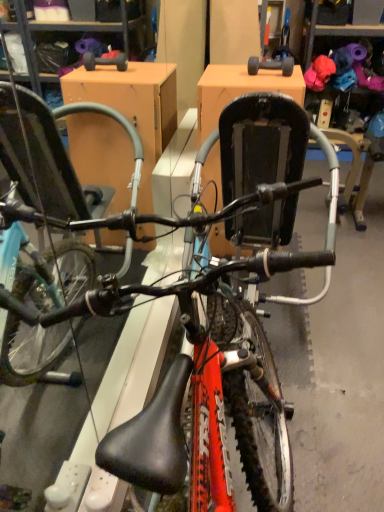
Question: From a real-world perspective, is shiny red bicycle at center positioned above or below gray rubber dumbbell at upper center?

Choices:
 (A) above
 (B) below

Answer: (B)

Question: Based on their sizes in the image, would you say shiny red bicycle at center is bigger or smaller than gray rubber dumbbell at upper center?

Choices:
 (A) big
 (B) small

Answer: (A)

Question: Is shiny red bicycle at center situated inside gray rubber dumbbell at upper center or outside?

Choices:
 (A) inside
 (B) outside

Answer: (B)

Question: Relative to shiny red bicycle at center, is gray rubber dumbbell at upper center in front or behind?

Choices:
 (A) behind
 (B) front

Answer: (A)

Question: In terms of size, does gray rubber dumbbell at upper center appear bigger or smaller than shiny red bicycle at center?

Choices:
 (A) big
 (B) small

Answer: (B)

Question: From the image's perspective, relative to shiny red bicycle at center, is gray rubber dumbbell at upper center above or below?

Choices:
 (A) below
 (B) above

Answer: (B)

Question: Visually, is gray rubber dumbbell at upper center positioned to the left or to the right of shiny red bicycle at center?

Choices:
 (A) right
 (B) left

Answer: (A)